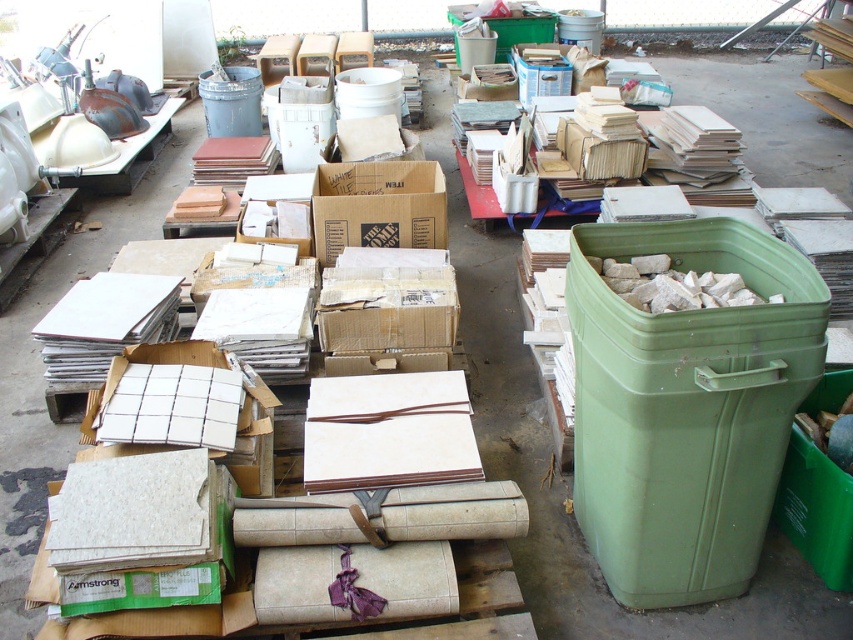
Looking at this image, you are standing in the storage area and want to locate two specific points marked in the image. Which point, point (723, 400) or point (257, 115), is closer to you?

Point (723, 400) is closer to you than point (257, 115).

You are organizing the storage area and need to place a large cardboard box. Which container, the green plastic recycling bin at right or the metallic gray trash can at upper left, can accommodate the box based on their sizes?

The green plastic recycling bin at right is larger in size than the metallic gray trash can at upper left, so the large cardboard box can fit into the green plastic recycling bin at right.